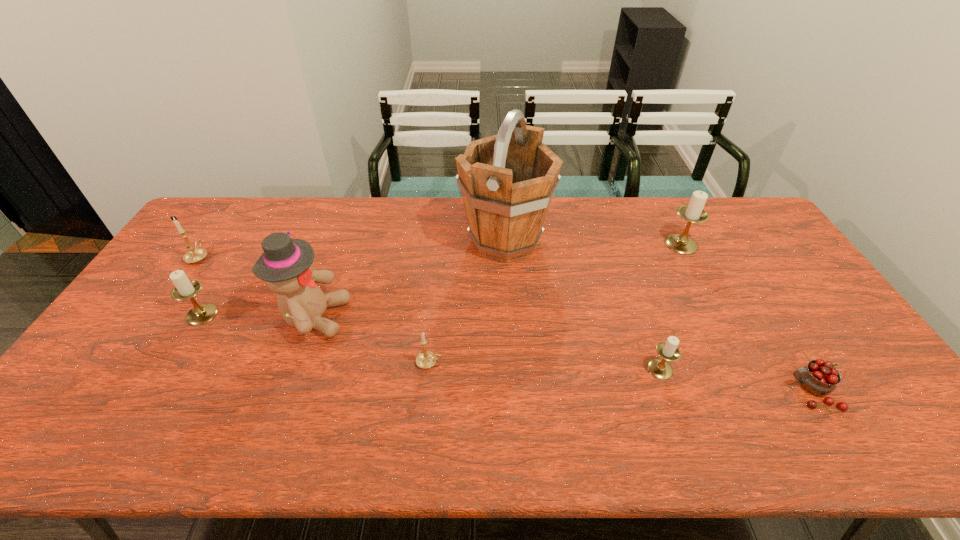
Locate an element on the screen. The width and height of the screenshot is (960, 540). the fourth object from left to right is located at coordinates (426, 359).

Find the location of a particular element. the third candle holder from right to left is located at coordinates (426, 359).

Where is `the nearest white candle holder`? The height and width of the screenshot is (540, 960). the nearest white candle holder is located at coordinates (659, 368).

Where is `the second candle holder from right to left`? the second candle holder from right to left is located at coordinates (659, 368).

Locate an element on the screen. This screenshot has width=960, height=540. the rightmost object is located at coordinates (819, 377).

Find the location of a particular element. The image size is (960, 540). cherry is located at coordinates (819, 377).

Find the location of `free region located on the front of the bucket`. free region located on the front of the bucket is located at coordinates (515, 384).

In order to click on free space located on the front-facing side of the sixth object from right to left in this screenshot , I will do `click(393, 317)`.

Locate an element on the screen. This screenshot has width=960, height=540. free spot located on the left of the rightmost candle holder is located at coordinates (600, 244).

You are a GUI agent. You are given a task and a screenshot of the screen. Output one action in this format:
    pyautogui.click(x=<x>, y=<y>)
    Task: Click on the vacant space located 0.070m on the handle side of the leftmost candle holder
    The image size is (960, 540).
    Given the screenshot: What is the action you would take?
    pyautogui.click(x=214, y=234)